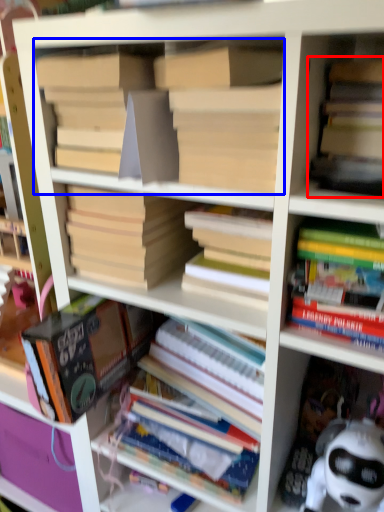
Question: Among these objects, which one is farthest to the camera, book (highlighted by a red box) or book (highlighted by a blue box)?

Choices:
 (A) book
 (B) book

Answer: (B)